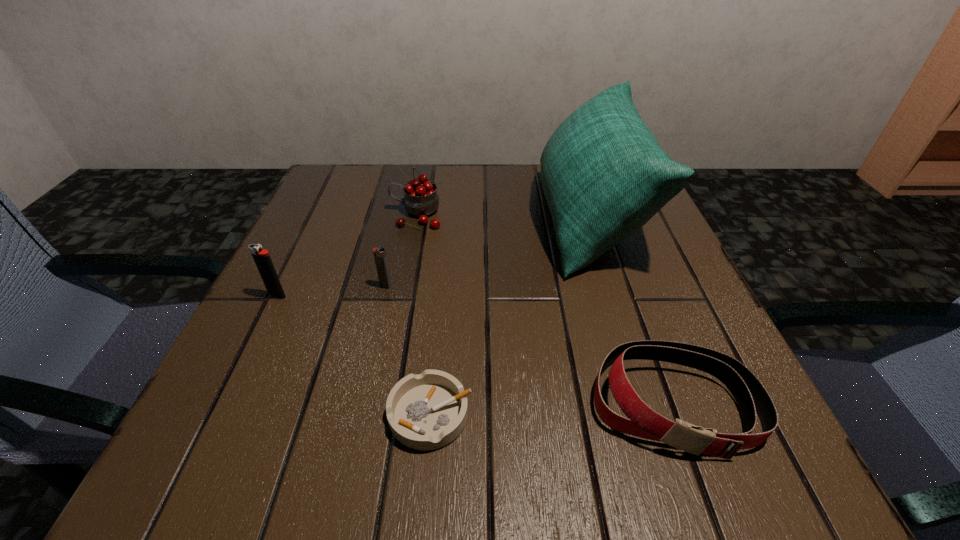
This screenshot has height=540, width=960. I want to click on vacant space located on the front-facing side of the cushion, so click(354, 218).

Find the location of a particular element. The width and height of the screenshot is (960, 540). vacant point located 0.150m on the handle side of the cherry is located at coordinates (322, 215).

This screenshot has width=960, height=540. I want to click on free space located 0.050m on the handle side of the cherry, so click(367, 215).

You are a GUI agent. You are given a task and a screenshot of the screen. Output one action in this format:
    pyautogui.click(x=<x>, y=<y>)
    Task: Click on the vacant area located 0.080m on the handle side of the cherry
    The width and height of the screenshot is (960, 540).
    Given the screenshot: What is the action you would take?
    pyautogui.click(x=353, y=215)

Locate an element on the screen. This screenshot has width=960, height=540. free space located 0.380m on the back of the leftmost object is located at coordinates (332, 183).

I want to click on free space located 0.120m on the front of the shorter igniter, so click(373, 341).

Locate an element on the screen. This screenshot has height=540, width=960. vacant space located on the left of the dog collar is located at coordinates (400, 403).

The width and height of the screenshot is (960, 540). What are the coordinates of `blank area located 0.380m on the right of the ashtray` in the screenshot? It's located at (748, 414).

Find the location of `cushion at the far edge`. cushion at the far edge is located at coordinates (604, 175).

The image size is (960, 540). I want to click on cherry located at the far edge, so click(421, 199).